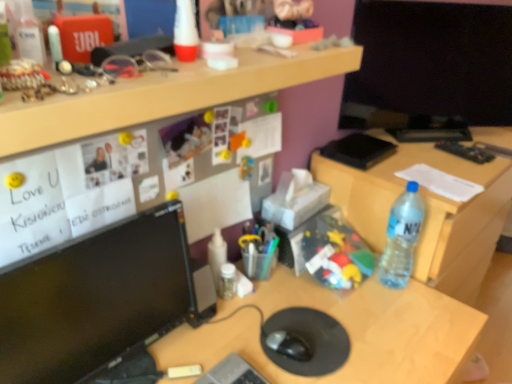
You are a GUI agent. You are given a task and a screenshot of the screen. Output one action in this format:
    pyautogui.click(x=<x>, y=<y>)
    Task: Click on the free location to the right of black matte notepad at upper right
    
    Given the screenshot: What is the action you would take?
    pyautogui.click(x=409, y=152)